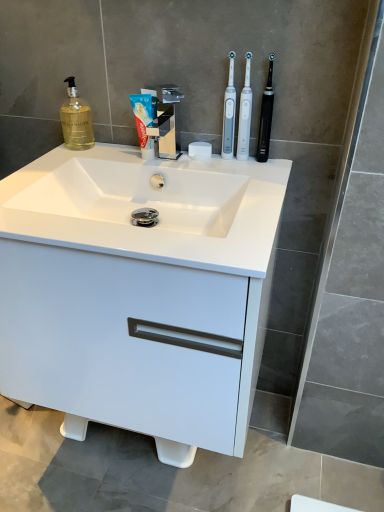
The image size is (384, 512). Describe the element at coordinates (266, 116) in the screenshot. I see `black rubberized toothbrush at upper right, placed as the 1th toothbrush when sorted from right to left` at that location.

Locate an element on the screen. white matte soap at center is located at coordinates (200, 150).

Image resolution: width=384 pixels, height=512 pixels. Describe the element at coordinates (245, 114) in the screenshot. I see `white plastic toothbrush at upper right, the second toothbrush viewed from the left` at that location.

I want to click on black rubberized toothbrush at upper right, placed as the 1th toothbrush when sorted from right to left, so click(266, 116).

Based on the photo, relative to white plastic toothbrush at upper right, positioned as the 2th toothbrush in right-to-left order, is polished chrome faucet at center in front or behind?

polished chrome faucet at center is in front of white plastic toothbrush at upper right, positioned as the 2th toothbrush in right-to-left order.

Considering the relative sizes of polished chrome faucet at center and white plastic toothbrush at upper right, the second toothbrush viewed from the left, in the image provided, is polished chrome faucet at center bigger than white plastic toothbrush at upper right, the second toothbrush viewed from the left,?

Yes.

Can you confirm if polished chrome faucet at center is thinner than white plastic toothbrush at upper right, positioned as the 2th toothbrush in right-to-left order?

In fact, polished chrome faucet at center might be wider than white plastic toothbrush at upper right, positioned as the 2th toothbrush in right-to-left order.

Between point (156, 98) and point (246, 110), which one is positioned behind?

Point (156, 98)

Is point (240, 146) behind point (171, 95)?

Yes, it is behind point (171, 95).

Does white plastic toothbrush at upper right, positioned as the 2th toothbrush in right-to-left order, have a greater height compared to polished chrome faucet at center?

Yes, white plastic toothbrush at upper right, positioned as the 2th toothbrush in right-to-left order, is taller than polished chrome faucet at center.

Is white plastic toothbrush at upper right, the second toothbrush viewed from the left, oriented towards polished chrome faucet at center?

No, white plastic toothbrush at upper right, the second toothbrush viewed from the left, is not aimed at polished chrome faucet at center.

From the image's perspective, is white plastic toothbrush at upper right, the second toothbrush viewed from the left, beneath polished chrome faucet at center?

Incorrect, from the image's perspective, white plastic toothbrush at upper right, the second toothbrush viewed from the left, is higher than polished chrome faucet at center.

From a real-world perspective, is white glossy cabinet at center beneath white glossy toothpaste at center?

Correct, in the physical world, white glossy cabinet at center is lower than white glossy toothpaste at center.

This screenshot has width=384, height=512. I want to click on toothpaste behind the white glossy cabinet at center, so click(x=143, y=123).

Is white glossy cabinet at center to the left or to the right of white glossy toothpaste at center in the image?

white glossy cabinet at center is positioned on white glossy toothpaste at center's right side.

Is white glossy cabinet at center facing away from white glossy toothpaste at center?

white glossy cabinet at center is not turned away from white glossy toothpaste at center.

Considering the relative sizes of white plastic toothbrush at upper right, the first toothbrush positioned from the left, and white glossy cabinet at center in the image provided, is white plastic toothbrush at upper right, the first toothbrush positioned from the left, bigger than white glossy cabinet at center?

No, white plastic toothbrush at upper right, the first toothbrush positioned from the left, is not bigger than white glossy cabinet at center.

Is white plastic toothbrush at upper right, the first toothbrush positioned from the left, facing away from white glossy cabinet at center?

No.

Is white plastic toothbrush at upper right, the first toothbrush positioned from the left, wider or thinner than white glossy cabinet at center?

Clearly, white plastic toothbrush at upper right, the first toothbrush positioned from the left, has less width compared to white glossy cabinet at center.

Where is `the 3rd toothbrush behind when counting from the white glossy cabinet at center`? the 3rd toothbrush behind when counting from the white glossy cabinet at center is located at coordinates (229, 113).

What's the angular difference between white glossy toothpaste at center and white plastic toothbrush at upper right, arranged as the third toothbrush when viewed from the right,'s facing directions?

They differ by 2.01 degrees in their facing directions.

Is white glossy toothpaste at center inside the boundaries of white plastic toothbrush at upper right, arranged as the third toothbrush when viewed from the right, or outside?

white glossy toothpaste at center is located beyond the bounds of white plastic toothbrush at upper right, arranged as the third toothbrush when viewed from the right.

In the image, is white glossy toothpaste at center on the left side or the right side of white plastic toothbrush at upper right, arranged as the third toothbrush when viewed from the right?

From the image, it's evident that white glossy toothpaste at center is to the left of white plastic toothbrush at upper right, arranged as the third toothbrush when viewed from the right.

Is white glossy toothpaste at center far from white plastic toothbrush at upper right, arranged as the third toothbrush when viewed from the right?

Actually, white glossy toothpaste at center and white plastic toothbrush at upper right, arranged as the third toothbrush when viewed from the right, are a little close together.

From the image's perspective, which one is positioned lower, white plastic toothbrush at upper right, positioned as the 2th toothbrush in right-to-left order, or black rubberized toothbrush at upper right, which ranks as the third toothbrush in left-to-right order?

black rubberized toothbrush at upper right, which ranks as the third toothbrush in left-to-right order, from the image's perspective.

Considering their positions, is white plastic toothbrush at upper right, positioned as the 2th toothbrush in right-to-left order, located in front of or behind black rubberized toothbrush at upper right, which ranks as the third toothbrush in left-to-right order?

white plastic toothbrush at upper right, positioned as the 2th toothbrush in right-to-left order, is behind black rubberized toothbrush at upper right, which ranks as the third toothbrush in left-to-right order.

Is white plastic toothbrush at upper right, the second toothbrush viewed from the left, not inside black rubberized toothbrush at upper right, placed as the 1th toothbrush when sorted from right to left?

Yes, white plastic toothbrush at upper right, the second toothbrush viewed from the left, is outside of black rubberized toothbrush at upper right, placed as the 1th toothbrush when sorted from right to left.

How many degrees apart are the facing directions of white plastic toothbrush at upper right, positioned as the 2th toothbrush in right-to-left order, and black rubberized toothbrush at upper right, which ranks as the third toothbrush in left-to-right order?

white plastic toothbrush at upper right, positioned as the 2th toothbrush in right-to-left order, and black rubberized toothbrush at upper right, which ranks as the third toothbrush in left-to-right order, are facing 0.00632 degrees away from each other.

Can you confirm if white glossy cabinet at center is thinner than white plastic toothbrush at upper right, the second toothbrush viewed from the left?

Incorrect, the width of white glossy cabinet at center is not less than that of white plastic toothbrush at upper right, the second toothbrush viewed from the left.

From the picture: Is white glossy cabinet at center further to the viewer compared to white plastic toothbrush at upper right, positioned as the 2th toothbrush in right-to-left order?

No, white glossy cabinet at center is in front of white plastic toothbrush at upper right, positioned as the 2th toothbrush in right-to-left order.

In order to click on the 2nd toothbrush behind when counting from the polished chrome faucet at center in this screenshot , I will do click(x=245, y=114).

From the polished chrome faucet at center, count 2nd toothbrush to the right and point to it. Please provide its 2D coordinates.

[(245, 114)]

Based on their spatial positions, is white glossy sink at center or white plastic toothbrush at upper right, positioned as the 2th toothbrush in right-to-left order, further from polished chrome faucet at center?

Among the two, white glossy sink at center is located further to polished chrome faucet at center.

Based on their spatial positions, is white plastic toothbrush at upper right, positioned as the 2th toothbrush in right-to-left order, or black rubberized toothbrush at upper right, which ranks as the third toothbrush in left-to-right order, further from white matte soap at center?

black rubberized toothbrush at upper right, which ranks as the third toothbrush in left-to-right order, is further to white matte soap at center.

Looking at this image, based on their spatial positions, is white glossy toothpaste at center or black rubberized toothbrush at upper right, which ranks as the third toothbrush in left-to-right order, further from white plastic toothbrush at upper right, the second toothbrush viewed from the left?

white glossy toothpaste at center.

From the image, which object appears to be nearer to white matte soap at center, polished chrome faucet at center or white plastic toothbrush at upper right, arranged as the third toothbrush when viewed from the right?

white plastic toothbrush at upper right, arranged as the third toothbrush when viewed from the right, is closer to white matte soap at center.

Based on their spatial positions, is white plastic toothbrush at upper right, positioned as the 2th toothbrush in right-to-left order, or white plastic toothbrush at upper right, arranged as the third toothbrush when viewed from the right, further from black rubberized toothbrush at upper right, placed as the 1th toothbrush when sorted from right to left?

white plastic toothbrush at upper right, arranged as the third toothbrush when viewed from the right, is positioned further to the anchor black rubberized toothbrush at upper right, placed as the 1th toothbrush when sorted from right to left.

Based on the photo, based on their spatial positions, is white plastic toothbrush at upper right, the second toothbrush viewed from the left, or black rubberized toothbrush at upper right, placed as the 1th toothbrush when sorted from right to left, closer to white glossy toothpaste at center?

white plastic toothbrush at upper right, the second toothbrush viewed from the left, is positioned closer to the anchor white glossy toothpaste at center.

Estimate the real-world distances between objects in this image. Which object is further from white glossy toothpaste at center, white plastic toothbrush at upper right, arranged as the third toothbrush when viewed from the right, or white matte soap at center?

white plastic toothbrush at upper right, arranged as the third toothbrush when viewed from the right, is further to white glossy toothpaste at center.

Based on their spatial positions, is white glossy cabinet at center or white glossy toothpaste at center closer to white plastic toothbrush at upper right, arranged as the third toothbrush when viewed from the right?

white glossy toothpaste at center is closer to white plastic toothbrush at upper right, arranged as the third toothbrush when viewed from the right.

This screenshot has height=512, width=384. Find the location of `bathroom cabinet between white glossy sink at center and white matte soap at center from front to back`. bathroom cabinet between white glossy sink at center and white matte soap at center from front to back is located at coordinates (139, 291).

The image size is (384, 512). What are the coordinates of `soap situated between white glossy toothpaste at center and white plastic toothbrush at upper right, arranged as the third toothbrush when viewed from the right, from left to right` in the screenshot? It's located at (200, 150).

You are a GUI agent. You are given a task and a screenshot of the screen. Output one action in this format:
    pyautogui.click(x=<x>, y=<y>)
    Task: Click on the tap positioned between white glossy sink at center and white plastic toothbrush at upper right, the first toothbrush positioned from the left, from near to far
    
    Given the screenshot: What is the action you would take?
    pyautogui.click(x=166, y=120)

Locate an element on the screen. sink between white plastic toothbrush at upper right, the second toothbrush viewed from the left, and white glossy cabinet at center vertically is located at coordinates (150, 205).